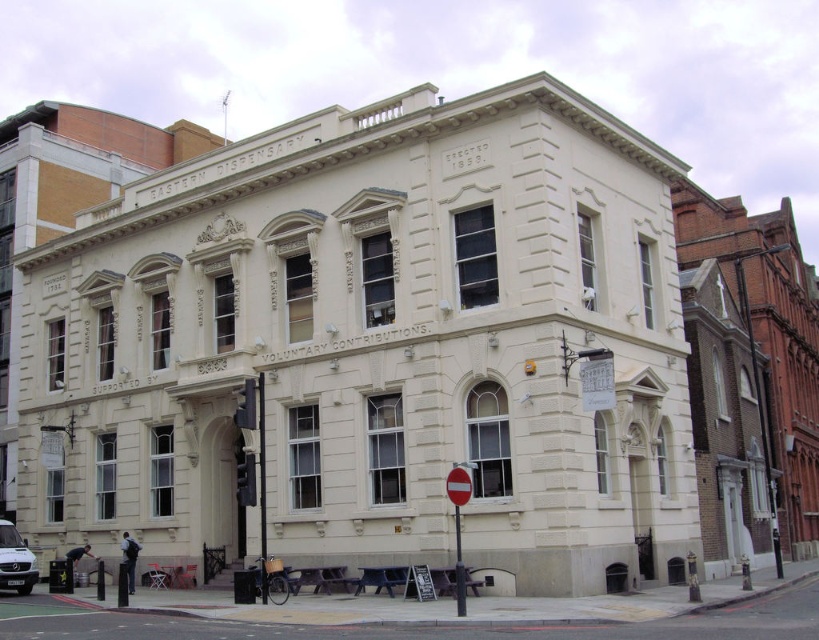
Question: Is silver metallic van at lower left below red plastic sign at center?

Choices:
 (A) yes
 (B) no

Answer: (A)

Question: Among these objects, which one is nearest to the camera?

Choices:
 (A) red plastic sign at center
 (B) silver metallic van at lower left

Answer: (A)

Question: Does silver metallic van at lower left appear over red plastic sign at center?

Choices:
 (A) yes
 (B) no

Answer: (B)

Question: Among these points, which one is nearest to the camera?

Choices:
 (A) (1, 580)
 (B) (455, 541)

Answer: (B)

Question: Can you confirm if silver metallic van at lower left is thinner than red plastic sign at center?

Choices:
 (A) yes
 (B) no

Answer: (B)